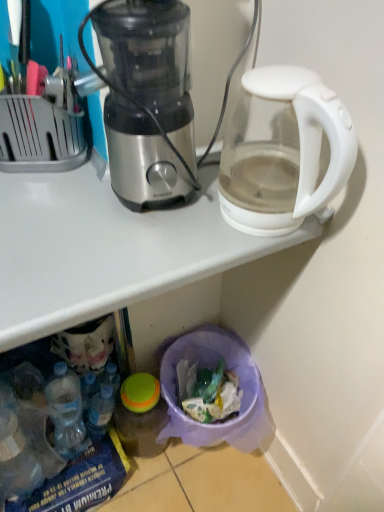
Find the location of a particular element. The width and height of the screenshot is (384, 512). free space to the left of transparent glass kettle at upper right is located at coordinates (166, 246).